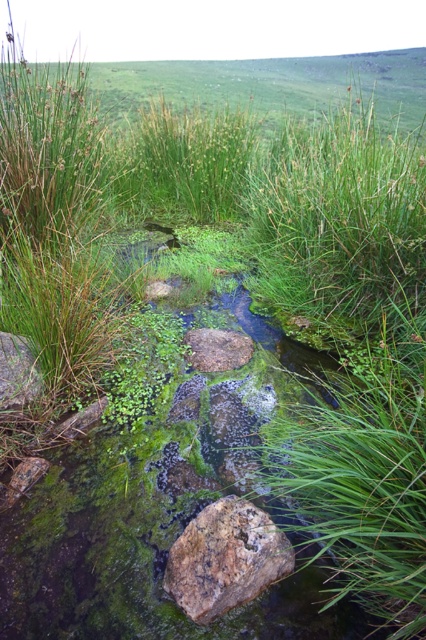
Question: Is the position of brown rough rock at center more distant than that of brown rough stone at center?

Choices:
 (A) yes
 (B) no

Answer: (B)

Question: Among these objects, which one is nearest to the camera?

Choices:
 (A) brown rough stone at center
 (B) smooth gray rock at lower left
 (C) brown rough rock at center

Answer: (C)

Question: Which object appears closest to the camera in this image?

Choices:
 (A) brown rough stone at center
 (B) brown rough rock at center

Answer: (B)

Question: Is the position of smooth gray rock at lower left more distant than that of brown rough stone at center?

Choices:
 (A) yes
 (B) no

Answer: (B)

Question: Which is farther from the brown rough stone at center?

Choices:
 (A) smooth gray rock at lower left
 (B) brown rough rock at center

Answer: (B)

Question: Considering the relative positions of smooth gray rock at lower left and brown rough stone at center in the image provided, where is smooth gray rock at lower left located with respect to brown rough stone at center?

Choices:
 (A) left
 (B) right

Answer: (A)